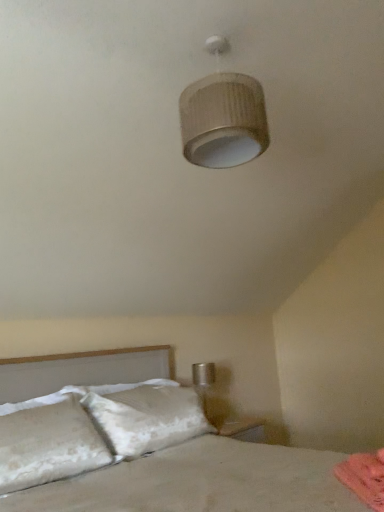
This screenshot has height=512, width=384. Identify the location of white textured bed at lower left. (154, 460).

What do you see at coordinates (364, 477) in the screenshot? I see `pink fabric at lower right` at bounding box center [364, 477].

Where is `white textured bed at lower left`? white textured bed at lower left is located at coordinates (154, 460).

Can you confirm if pink fabric at lower right is thinner than white textured bed at lower left?

Indeed, pink fabric at lower right has a lesser width compared to white textured bed at lower left.

Is pink fabric at lower right bigger than white textured bed at lower left?

No.

From a real-world perspective, who is located lower, pink fabric at lower right or white textured bed at lower left?

In real-world perspective, pink fabric at lower right is lower.

Where is `bed that appears in front of the pink fabric at lower right`? This screenshot has height=512, width=384. bed that appears in front of the pink fabric at lower right is located at coordinates (154, 460).

The width and height of the screenshot is (384, 512). In order to click on bed below the matte beige lampshade at upper center (from the image's perspective) in this screenshot , I will do `click(154, 460)`.

Considering the relative sizes of matte beige lampshade at upper center and white textured bed at lower left in the image provided, is matte beige lampshade at upper center bigger than white textured bed at lower left?

No.

Does matte beige lampshade at upper center have a greater width compared to white textured bed at lower left?

In fact, matte beige lampshade at upper center might be narrower than white textured bed at lower left.

From a real-world perspective, between matte beige lampshade at upper center and white textured bed at lower left, who is vertically lower?

From a 3D spatial view, white textured bed at lower left is below.

Is white textured bed at lower left positioned with its back to pink fabric at lower right?

That's not correct — white textured bed at lower left is not looking away from pink fabric at lower right.

Would you say white textured bed at lower left is a long distance from pink fabric at lower right?

Actually, white textured bed at lower left and pink fabric at lower right are a little close together.

From a real-world perspective, who is located higher, white textured bed at lower left or pink fabric at lower right?

In real-world perspective, white textured bed at lower left is above.

Visually, is white textured bed at lower left positioned to the left or to the right of pink fabric at lower right?

Based on their positions, white textured bed at lower left is located to the left of pink fabric at lower right.

Which point is more forward, (255, 141) or (355, 490)?

Point (355, 490)

Can you confirm if matte beige lampshade at upper center is positioned to the left of pink fabric at lower right?

Indeed, matte beige lampshade at upper center is positioned on the left side of pink fabric at lower right.

Who is shorter, matte beige lampshade at upper center or pink fabric at lower right?

Standing shorter between the two is pink fabric at lower right.

How much distance is there between matte beige lampshade at upper center and pink fabric at lower right?

matte beige lampshade at upper center is 4.37 feet away from pink fabric at lower right.

Relative to matte beige lampshade at upper center, is pink fabric at lower right in front or behind?

Clearly, pink fabric at lower right is in front of matte beige lampshade at upper center.

Between pink fabric at lower right and matte beige lampshade at upper center, which one has less height?

pink fabric at lower right is shorter.

Consider the image. Who is smaller, pink fabric at lower right or matte beige lampshade at upper center?

pink fabric at lower right is smaller.

Can you tell me how much white textured bed at lower left and matte beige lampshade at upper center differ in facing direction?

1.36 degrees separate the facing orientations of white textured bed at lower left and matte beige lampshade at upper center.

Which of these two, white textured bed at lower left or matte beige lampshade at upper center, is bigger?

Bigger between the two is white textured bed at lower left.

Considering the positions of objects white textured bed at lower left and matte beige lampshade at upper center in the image provided, who is behind, white textured bed at lower left or matte beige lampshade at upper center?

matte beige lampshade at upper center is behind.

I want to click on bed above the pink fabric at lower right (from a real-world perspective), so click(x=154, y=460).

Where is `bed located below the matte beige lampshade at upper center (from the image's perspective)`? bed located below the matte beige lampshade at upper center (from the image's perspective) is located at coordinates (154, 460).

When comparing their distances from matte beige lampshade at upper center, does pink fabric at lower right or white textured bed at lower left seem closer?

Based on the image, pink fabric at lower right appears to be nearer to matte beige lampshade at upper center.

Looking at the image, which one is located closer to white textured bed at lower left, matte beige lampshade at upper center or pink fabric at lower right?

pink fabric at lower right lies closer to white textured bed at lower left than the other object.

Looking at the image, which one is located further to pink fabric at lower right, matte beige lampshade at upper center or white textured bed at lower left?

Based on the image, matte beige lampshade at upper center appears to be further to pink fabric at lower right.

Estimate the real-world distances between objects in this image. Which object is further from matte beige lampshade at upper center, white textured bed at lower left or pink fabric at lower right?

white textured bed at lower left is positioned further to the anchor matte beige lampshade at upper center.

Based on their spatial positions, is pink fabric at lower right or matte beige lampshade at upper center closer to white textured bed at lower left?

pink fabric at lower right lies closer to white textured bed at lower left than the other object.

Estimate the real-world distances between objects in this image. Which object is further from pink fabric at lower right, white textured bed at lower left or matte beige lampshade at upper center?

Based on the image, matte beige lampshade at upper center appears to be further to pink fabric at lower right.

Where is `bed between matte beige lampshade at upper center and pink fabric at lower right in the up-down direction`? The width and height of the screenshot is (384, 512). bed between matte beige lampshade at upper center and pink fabric at lower right in the up-down direction is located at coordinates (154, 460).